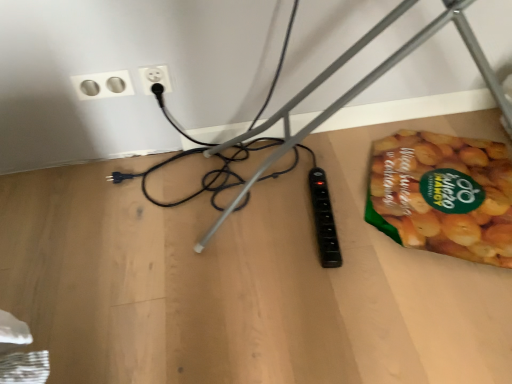
This screenshot has width=512, height=384. Identify the location of vacant point to the left of black plastic wire at lower right. (115, 252).